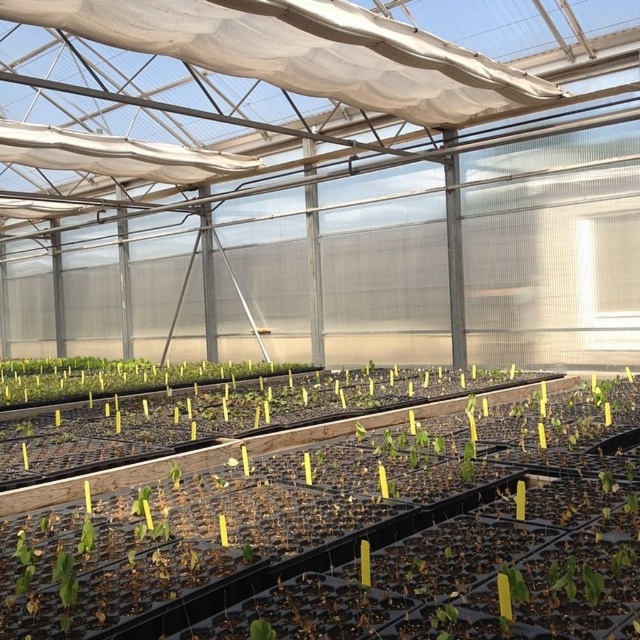
You are a gardener checking the spacing between the green leafy plants at center and the green leafy plant at center. Are they spaced far enough apart to avoid overcrowding?

The green leafy plants at center might be wider than the green leafy plant at center, so they may be too close together and could benefit from more space to prevent overcrowding.

In the greenhouse scene, there are two green leafy plants at center and a green leafy plant at center. Which one is taller?

The green leafy plant at center is taller than the green leafy plants at center.

You are a gardener who wants to identify the tallest plant in the greenhouse. Looking at the green matte seedling at center and the green matte leaf at center, which one is taller?

The green matte seedling at center is much taller than the green matte leaf at center, so the green matte seedling at center is the tallest plant.